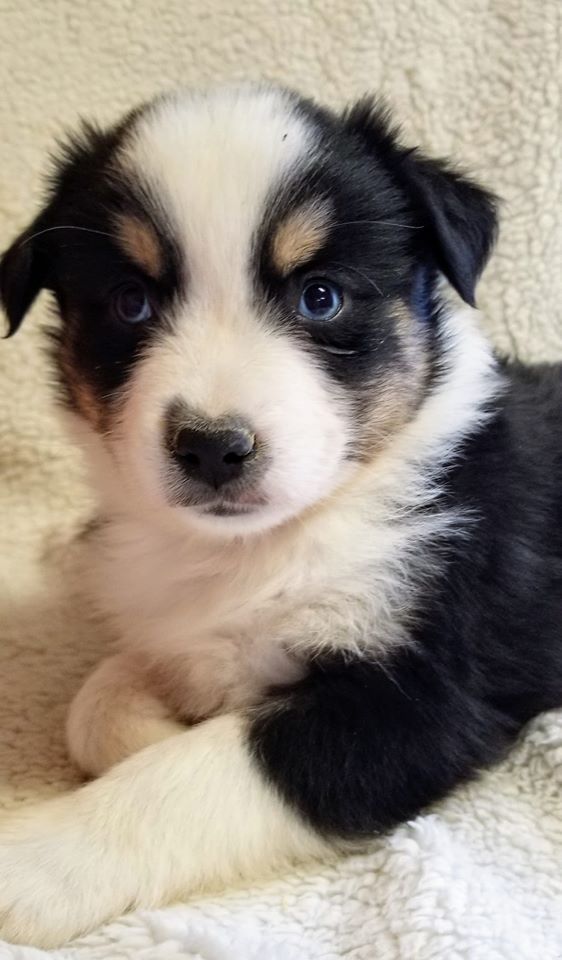
Where is `carpet`? carpet is located at coordinates (45, 657).